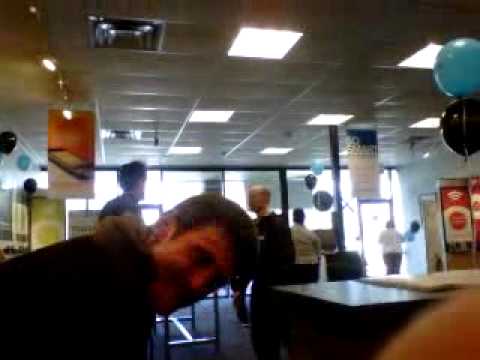
Find the location of a particular element. The width and height of the screenshot is (480, 360). table is located at coordinates (368, 299), (353, 286), (388, 293), (323, 302).